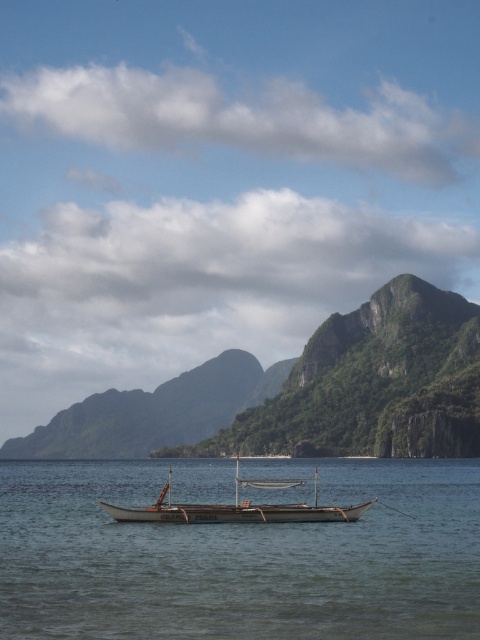
Who is more distant from viewer, (193, 388) or (280, 486)?

Point (193, 388)

Can you confirm if green textured mountain at center is thinner than wooden boat at center?

In fact, green textured mountain at center might be wider than wooden boat at center.

Describe the element at coordinates (303, 394) in the screenshot. The height and width of the screenshot is (640, 480). I see `green textured mountain at center` at that location.

Identify the location of green textured mountain at center. (303, 394).

Does clear water at boat center have a lesser height compared to green textured mountain at center?

Correct, clear water at boat center is not as tall as green textured mountain at center.

You are a GUI agent. You are given a task and a screenshot of the screen. Output one action in this format:
    pyautogui.click(x=<x>, y=<y>)
    Task: Click on the clear water at boat center
    The width and height of the screenshot is (480, 640).
    Given the screenshot: What is the action you would take?
    pyautogui.click(x=240, y=556)

At what (x,y) coordinates should I click in order to perform the action: click on clear water at boat center. Please return your answer as a coordinate pair (x, y). Looking at the image, I should click on (240, 556).

From the picture: Does clear water at boat center appear over wooden boat at center?

Incorrect, clear water at boat center is not positioned above wooden boat at center.

Is point (428, 484) in front of point (222, 520)?

No, it is behind (222, 520).

Who is more forward, (54, 556) or (370, 502)?

Point (54, 556) is more forward.

Where is `clear water at boat center`? The height and width of the screenshot is (640, 480). clear water at boat center is located at coordinates (240, 556).